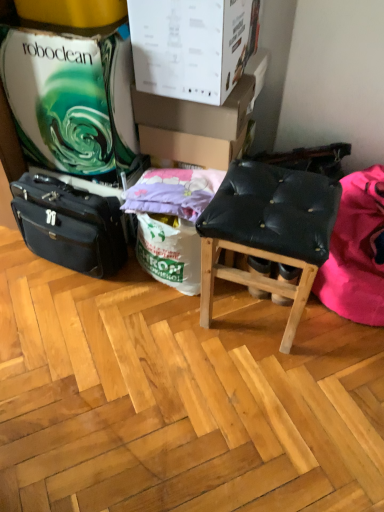
Question: Is purple cotton pillow at center not near black leather briefcase at left?

Choices:
 (A) no
 (B) yes

Answer: (A)

Question: From a real-world perspective, is purple cotton pillow at center physically below black leather briefcase at left?

Choices:
 (A) yes
 (B) no

Answer: (B)

Question: Is purple cotton pillow at center looking in the opposite direction of black leather briefcase at left?

Choices:
 (A) yes
 (B) no

Answer: (B)

Question: Can you confirm if purple cotton pillow at center is bigger than black leather briefcase at left?

Choices:
 (A) yes
 (B) no

Answer: (B)

Question: Does purple cotton pillow at center appear on the right side of black leather briefcase at left?

Choices:
 (A) yes
 (B) no

Answer: (A)

Question: Does purple cotton pillow at center have a lesser width compared to black leather briefcase at left?

Choices:
 (A) no
 (B) yes

Answer: (A)

Question: Does white cardboard box at upper center, placed as the third cardboard box when sorted from back to front, have a lesser width compared to cardboard box at upper center, which appears as the 2th cardboard box when viewed from the back?

Choices:
 (A) yes
 (B) no

Answer: (B)

Question: Is white cardboard box at upper center, placed as the 1th cardboard box when sorted from front to back, wider than cardboard box at upper center, acting as the second cardboard box starting from the front?

Choices:
 (A) yes
 (B) no

Answer: (A)

Question: Is white cardboard box at upper center, placed as the third cardboard box when sorted from back to front, positioned beyond the bounds of cardboard box at upper center, which appears as the 2th cardboard box when viewed from the back?

Choices:
 (A) yes
 (B) no

Answer: (A)

Question: Is white cardboard box at upper center, placed as the 1th cardboard box when sorted from front to back, smaller than cardboard box at upper center, acting as the second cardboard box starting from the front?

Choices:
 (A) yes
 (B) no

Answer: (B)

Question: Could cardboard box at upper center, acting as the second cardboard box starting from the front, be considered to be inside white cardboard box at upper center, placed as the 1th cardboard box when sorted from front to back?

Choices:
 (A) yes
 (B) no

Answer: (B)

Question: Considering the relative positions of white cardboard box at upper center, placed as the third cardboard box when sorted from back to front, and cardboard box at upper center, acting as the second cardboard box starting from the front, in the image provided, is white cardboard box at upper center, placed as the third cardboard box when sorted from back to front, to the left of cardboard box at upper center, acting as the second cardboard box starting from the front, from the viewer's perspective?

Choices:
 (A) yes
 (B) no

Answer: (A)

Question: From the image's perspective, does white cardboard box at upper center, placed as the third cardboard box when sorted from back to front, appear higher than purple cotton pillow at center?

Choices:
 (A) yes
 (B) no

Answer: (A)